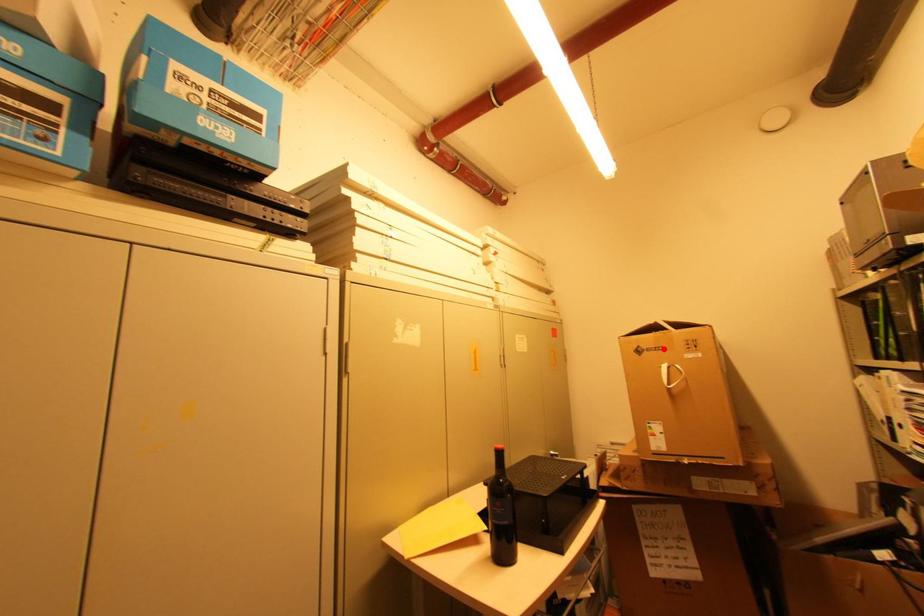
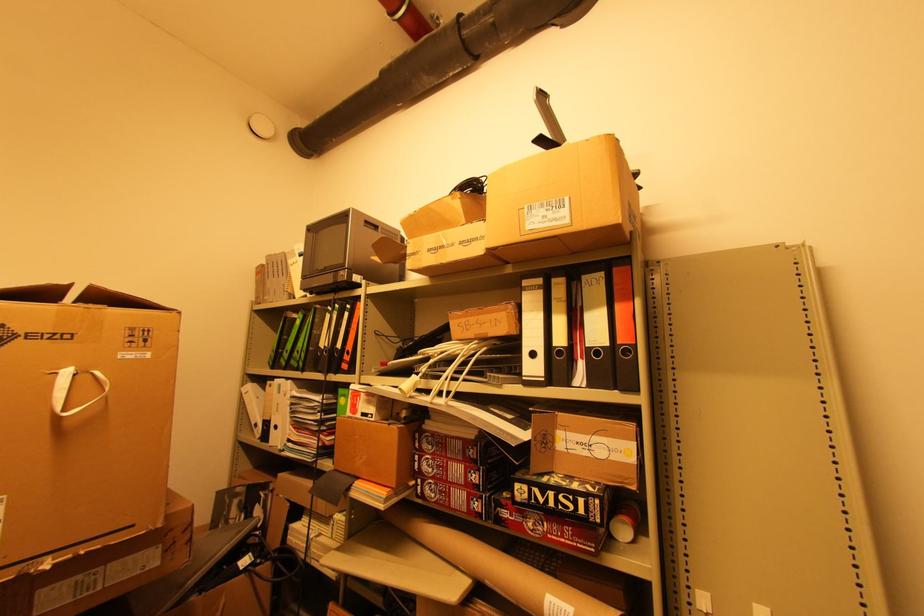
Locate, in the second image, the point that corresponds to the highlighted location in the first image.

(70, 338)